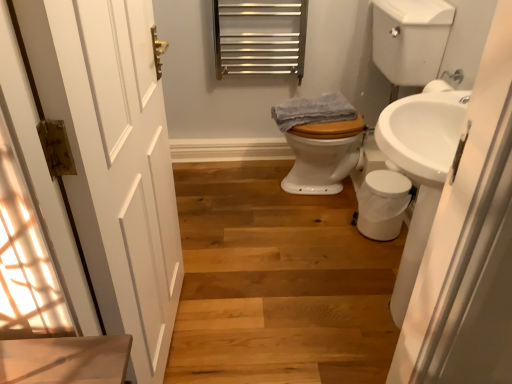
At what (x,y) coordinates should I click in order to perform the action: click on gray cotton towel at center. Please return your answer as a coordinate pair (x, y). The height and width of the screenshot is (384, 512). Looking at the image, I should click on (313, 111).

This screenshot has height=384, width=512. What do you see at coordinates (313, 111) in the screenshot?
I see `gray cotton towel at center` at bounding box center [313, 111].

The height and width of the screenshot is (384, 512). What are the coordinates of `white wooden door at left` in the screenshot? It's located at (114, 160).

Considering the relative sizes of white glossy sink at right and gray cotton towel at center in the image provided, is white glossy sink at right smaller than gray cotton towel at center?

No, white glossy sink at right is not smaller than gray cotton towel at center.

In the scene shown: Considering the sizes of objects white glossy sink at right and gray cotton towel at center in the image provided, who is shorter, white glossy sink at right or gray cotton towel at center?

gray cotton towel at center is shorter.

Considering the points (444, 316) and (322, 113), which point is behind, point (444, 316) or point (322, 113)?

Positioned behind is point (322, 113).

What's the angular difference between white glossy sink at right and gray cotton towel at center's facing directions?

white glossy sink at right and gray cotton towel at center are facing 9.03 degrees away from each other.

From a real-world perspective, is white wooden door at left positioned above or below gray cotton towel at center?

Clearly, from a real-world perspective, white wooden door at left is above gray cotton towel at center.

From the picture: Considering the relative sizes of white wooden door at left and gray cotton towel at center in the image provided, is white wooden door at left bigger than gray cotton towel at center?

Indeed, white wooden door at left has a larger size compared to gray cotton towel at center.

Considering the sizes of white wooden door at left and gray cotton towel at center in the image, is white wooden door at left wider or thinner than gray cotton towel at center?

white wooden door at left is thinner than gray cotton towel at center.

From the image's perspective, is white wooden door at left above gray cotton towel at center?

Actually, white wooden door at left appears below gray cotton towel at center in the image.

How different are the orientations of white glossy sink at right and white wooden door at left in degrees?

179 degrees separate the facing orientations of white glossy sink at right and white wooden door at left.

Does point (495, 232) come behind point (159, 370)?

No, it is in front of (159, 370).

The height and width of the screenshot is (384, 512). What are the coordinates of `screen door located below the white wooden door at left (from the image's perspective)` in the screenshot? It's located at (469, 244).

Is white glossy sink at right oriented away from white wooden door at left?

No, white wooden door at left is not at the back of white glossy sink at right.

Where is `door above the wooden stairs at lower left (from a real-world perspective)`? This screenshot has height=384, width=512. door above the wooden stairs at lower left (from a real-world perspective) is located at coordinates (114, 160).

In the image, is white wooden door at left on the left side or the right side of wooden stairs at lower left?

From the image, it's evident that white wooden door at left is to the left of wooden stairs at lower left.

Which object is more forward, white wooden door at left or wooden stairs at lower left?

Positioned in front is white wooden door at left.

Can you confirm if white wooden door at left is shorter than wooden stairs at lower left?

In fact, white wooden door at left may be taller than wooden stairs at lower left.

Is white wooden door at left placed right next to white glossy sink at right?

No, white wooden door at left is not with white glossy sink at right.

Is point (71, 84) more distant than point (433, 255)?

That is False.

From the image's perspective, which is below, white wooden door at left or white glossy sink at right?

white glossy sink at right.

Is white wooden door at left facing towards white glossy sink at right?

Yes, white wooden door at left is oriented towards white glossy sink at right.

Is white glossy toilet at center next to gray cotton towel at center and touching it?

No, white glossy toilet at center is not making contact with gray cotton towel at center.

From a real-world perspective, is white glossy toilet at center physically below gray cotton towel at center?

No.

Based on the photo, how far apart are white glossy toilet at center and gray cotton towel at center?

white glossy toilet at center and gray cotton towel at center are 5.76 inches apart from each other.

From the picture: What's the angular difference between white glossy toilet at center and gray cotton towel at center's facing directions?

The facing directions of white glossy toilet at center and gray cotton towel at center are 8.75 degrees apart.

Considering the sizes of objects gray cotton towel at center and white wooden door at left in the image provided, who is taller, gray cotton towel at center or white wooden door at left?

white wooden door at left.

Considering the sizes of gray cotton towel at center and white wooden door at left in the image, is gray cotton towel at center wider or thinner than white wooden door at left?

gray cotton towel at center is wider than white wooden door at left.

Does gray cotton towel at center turn towards white wooden door at left?

No, gray cotton towel at center does not turn towards white wooden door at left.

Do you think gray cotton towel at center is within white wooden door at left, or outside of it?

gray cotton towel at center is not inside white wooden door at left, it's outside.

You are a GUI agent. You are given a task and a screenshot of the screen. Output one action in this format:
    pyautogui.click(x=<x>, y=<y>)
    Task: Click on the screen door beneath the gray cotton towel at center (from a real-world perspective)
    The width and height of the screenshot is (512, 384).
    Given the screenshot: What is the action you would take?
    pyautogui.click(x=469, y=244)

At what (x,y) coordinates should I click in order to perform the action: click on door lying on the left of gray cotton towel at center. Please return your answer as a coordinate pair (x, y). The height and width of the screenshot is (384, 512). Looking at the image, I should click on (114, 160).

Estimate the real-world distances between objects in this image. Which object is closer to gray cotton towel at center, white glossy sink at right or wooden stairs at lower left?

The object closer to gray cotton towel at center is wooden stairs at lower left.

From the picture: Considering their positions, is white glossy toilet at center positioned closer to white glossy sink at right than white wooden door at left?

white wooden door at left.

Based on their spatial positions, is white glossy sink at right or white glossy toilet at center further from white wooden door at left?

white glossy toilet at center is further to white wooden door at left.

Based on the photo, which object lies nearer to the anchor point wooden stairs at lower left, white glossy sink at right or gray cotton towel at center?

gray cotton towel at center lies closer to wooden stairs at lower left than the other object.

When comparing their distances from white glossy toilet at center, does white glossy sink at right or white wooden door at left seem further?

Among the two, white glossy sink at right is located further to white glossy toilet at center.

Looking at the image, which one is located closer to wooden stairs at lower left, white glossy sink at right or white wooden door at left?

white wooden door at left lies closer to wooden stairs at lower left than the other object.

Considering their positions, is wooden stairs at lower left positioned closer to gray cotton towel at center than white glossy sink at right?

wooden stairs at lower left lies closer to gray cotton towel at center than the other object.

Estimate the real-world distances between objects in this image. Which object is further from white wooden door at left, white glossy toilet at center or white glossy sink at right?

white glossy toilet at center lies further to white wooden door at left than the other object.

This screenshot has width=512, height=384. Find the location of `screen door located between white wooden door at left and white glossy toilet at center in the depth direction`. screen door located between white wooden door at left and white glossy toilet at center in the depth direction is located at coordinates (469, 244).

Image resolution: width=512 pixels, height=384 pixels. Identify the location of landing between white wooden door at left and gray cotton towel at center in the front-back direction. (410, 40).

The height and width of the screenshot is (384, 512). What are the coordinates of `screen door between white wooden door at left and gray cotton towel at center from front to back` in the screenshot? It's located at (469, 244).

Find the location of a particular element. The width and height of the screenshot is (512, 384). stairs between white wooden door at left and white glossy toilet at center along the z-axis is located at coordinates (277, 282).